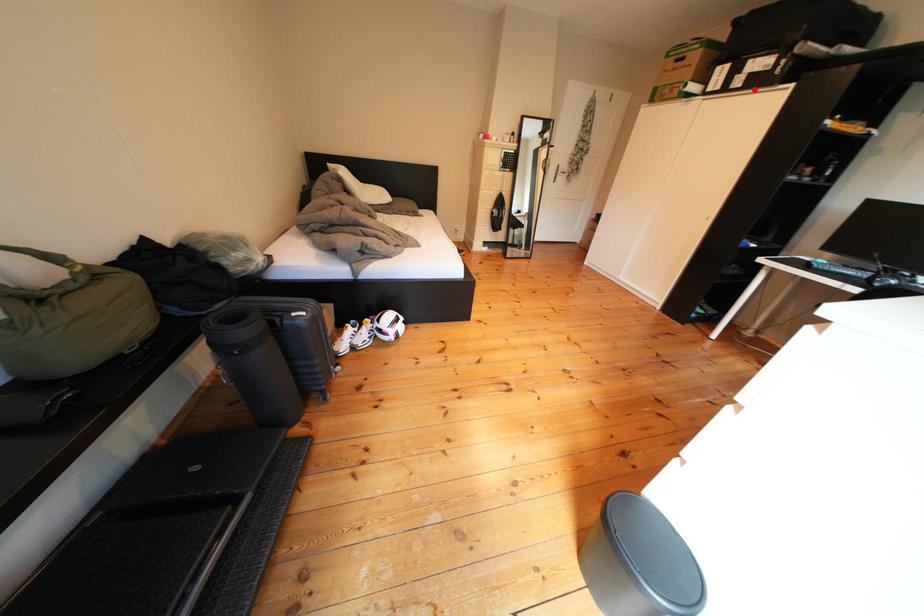
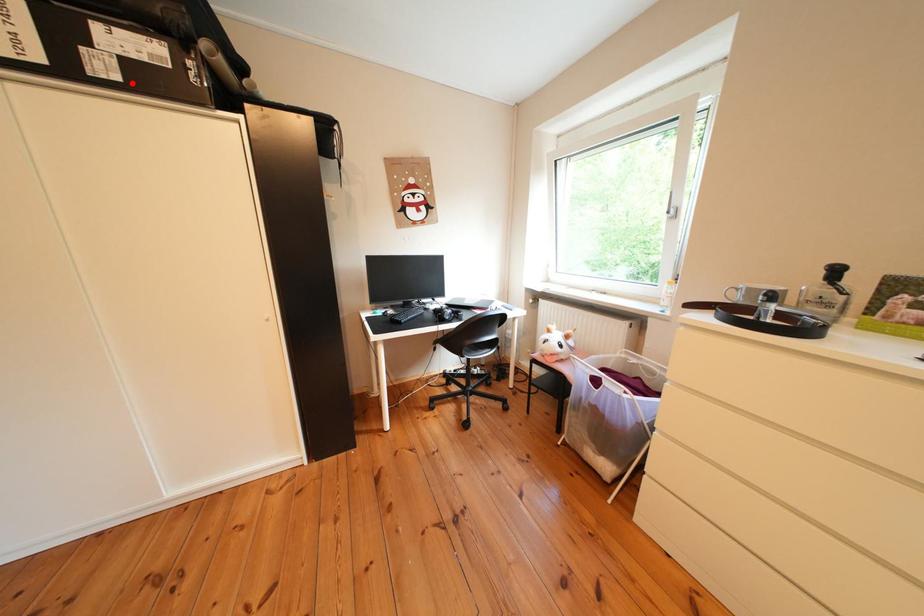
I am providing you with two images of the same scene from different viewpoints. A red point is marked on the first image and another point is marked on the second image. Do the highlighted points in image1 and image2 indicate the same real-world spot?

Yes